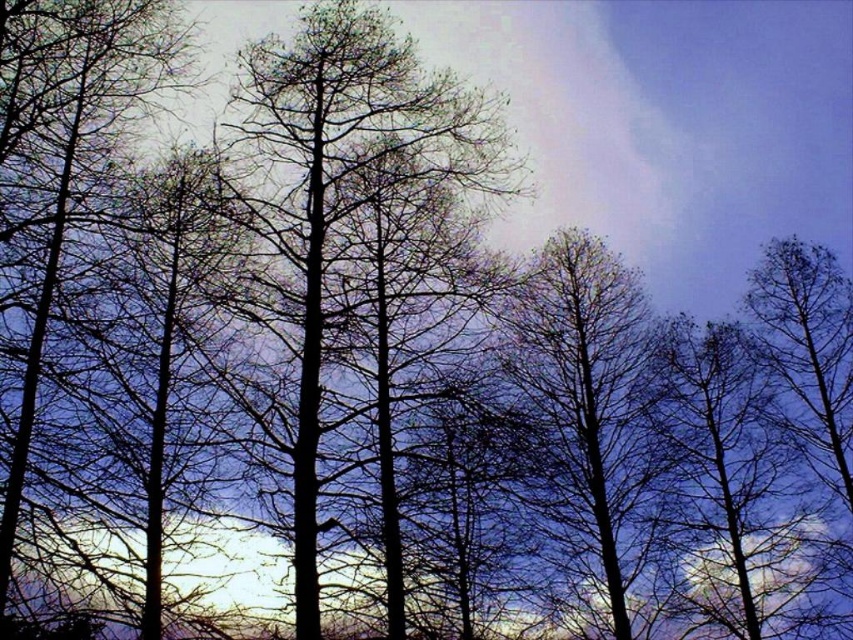
You are an artist sketching the scene and want to draw the smooth bark tree at center and silhouette bare tree at left. Which tree should you draw first if you are following the standard top to bottom drawing technique?

You should draw the silhouette bare tree at left first because it is located above the smooth bark tree at center, so starting from the top makes sense with the standard technique.

Consider the image. You are an artist sketching this scene. You want to draw the silhouette bare tree at left first. Should you draw it before or after drawing the bare branches at center?

You should draw the silhouette bare tree at left after drawing the bare branches at center because it is behind them, so layering the branches over the tree will create the correct spatial relationship.

You are an artist sketching the scene. You notice the smooth bark tree at center and the bare branches at center. Which one should you draw first if you want to follow the standard layering technique where foreground elements are drawn after background elements?

The smooth bark tree at center should be drawn first because it is above the bare branches at center, indicating it is in the background and should be layered before the foreground elements.